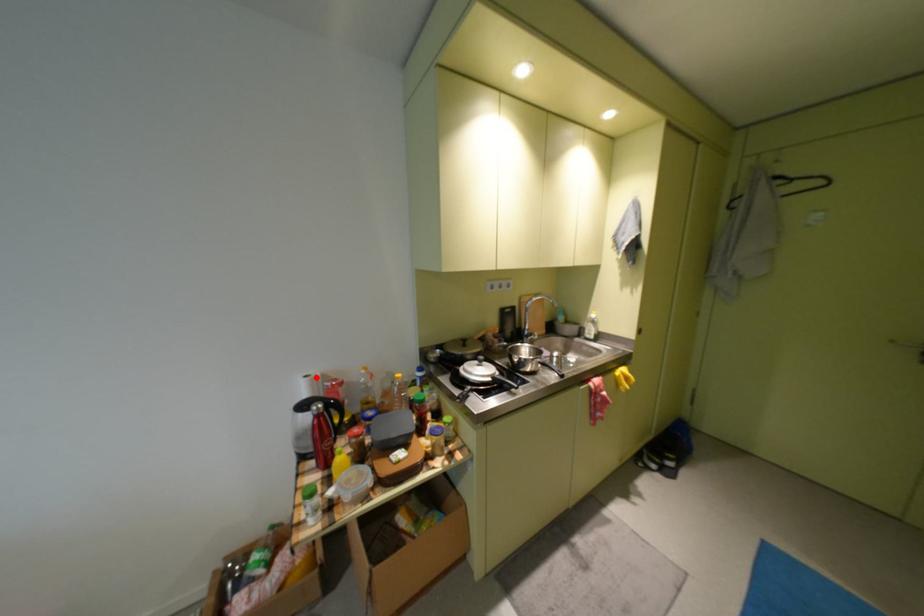
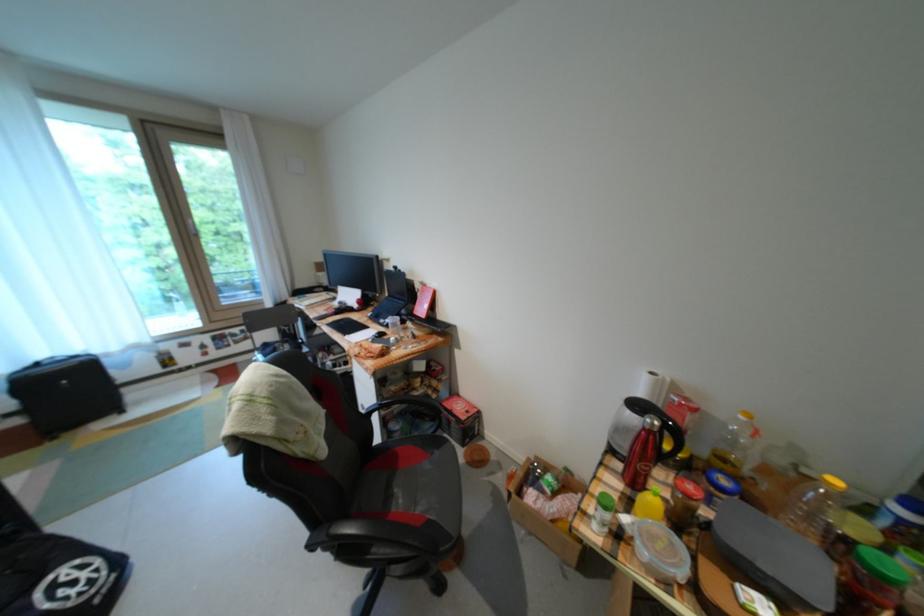
The point at the highlighted location is marked in the first image. Where is the corresponding point in the second image?

(662, 374)